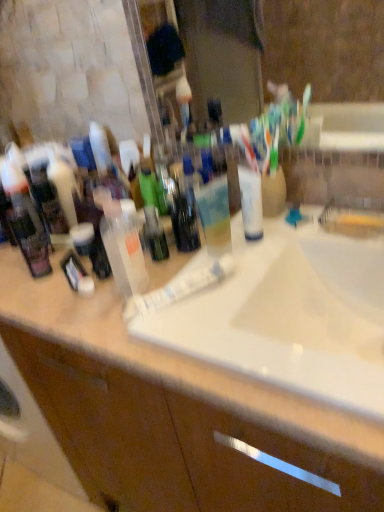
In order to click on free space in front of translucent plastic bottle at center, the 5th toiletry from the left in this screenshot , I will do `click(129, 328)`.